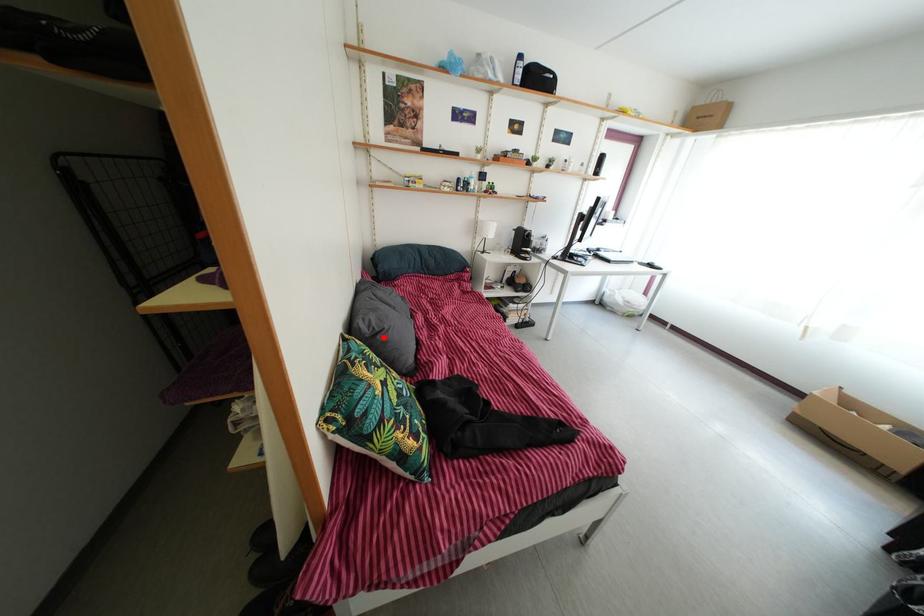
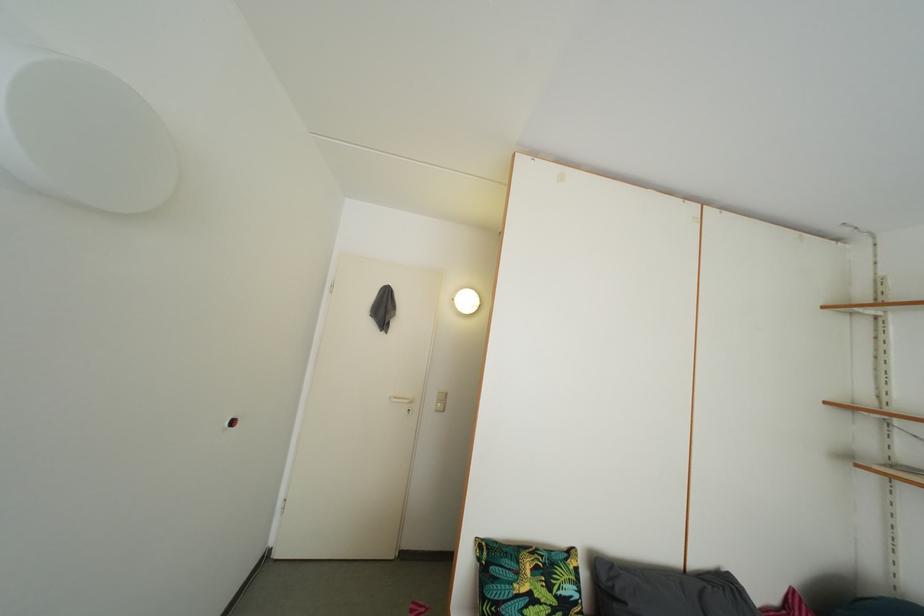
The point at the highlighted location is marked in the first image. Where is the corresponding point in the second image?

(624, 601)